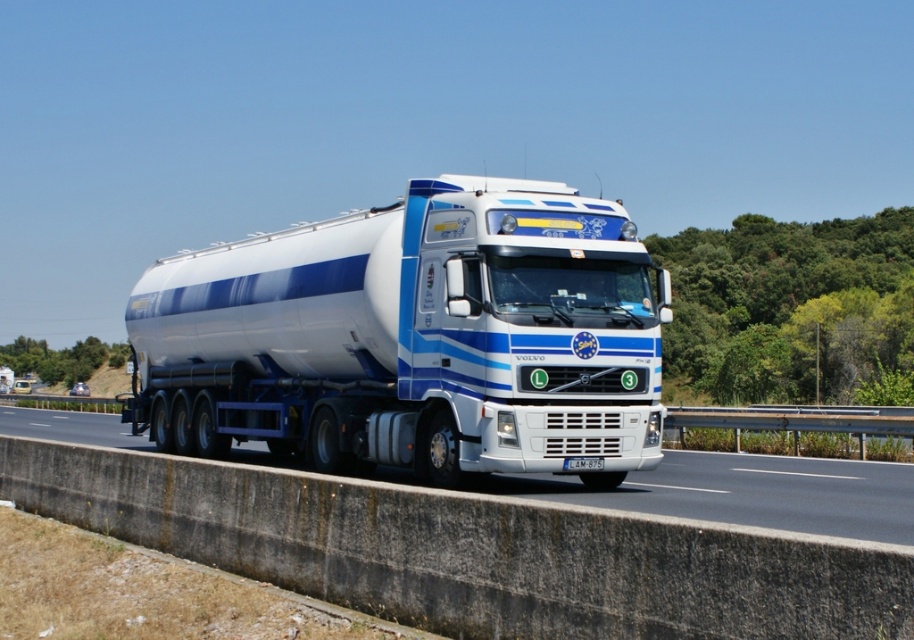
Between point (410, 305) and point (891, 500), which one is positioned in front?

Point (891, 500) is more forward.

What do you see at coordinates (415, 337) in the screenshot?
I see `white glossy tanker at center` at bounding box center [415, 337].

Find the location of a particular element. The width and height of the screenshot is (914, 640). white glossy tanker at center is located at coordinates (415, 337).